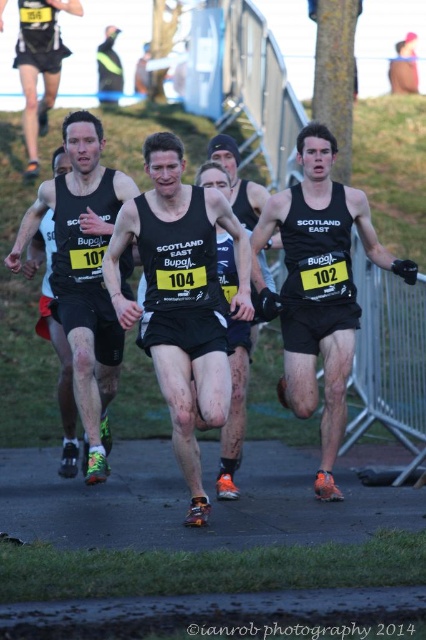
Does matte black tank top at upper left come in front of matte black tank top at center?

No, matte black tank top at upper left is further to the viewer.

Who is positioned more to the left, matte black tank top at upper left or matte black tank top at center?

Positioned to the left is matte black tank top at upper left.

Who is more distant from viewer, (46, 65) or (60, 417)?

The point (46, 65) is more distant.

You are a GUI agent. You are given a task and a screenshot of the screen. Output one action in this format:
    pyautogui.click(x=<x>, y=<y>)
    Task: Click on the matte black tank top at upper left
    
    Given the screenshot: What is the action you would take?
    pyautogui.click(x=40, y=65)

Who is positioned more to the left, black matte tank top at center or black matte singlet at center?

black matte tank top at center

Is black matte tank top at center behind black matte singlet at center?

No.

What do you see at coordinates (181, 298) in the screenshot? I see `black matte tank top at center` at bounding box center [181, 298].

Locate an element on the screen. The image size is (426, 640). black matte tank top at center is located at coordinates (x=181, y=298).

Is matte black shorts at center taller than matte black tank top at upper left?

Incorrect, matte black shorts at center's height is not larger of matte black tank top at upper left's.

Is matte black shorts at center above matte black tank top at upper left?

Actually, matte black shorts at center is below matte black tank top at upper left.

What do you see at coordinates (83, 273) in the screenshot? This screenshot has width=426, height=640. I see `matte black shorts at center` at bounding box center [83, 273].

Identify the location of matte black shorts at center. (83, 273).